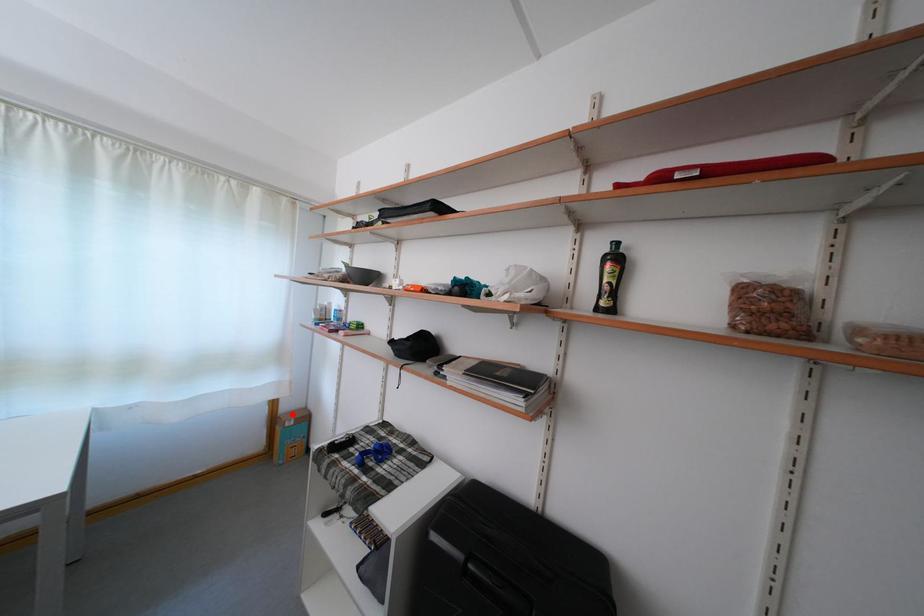
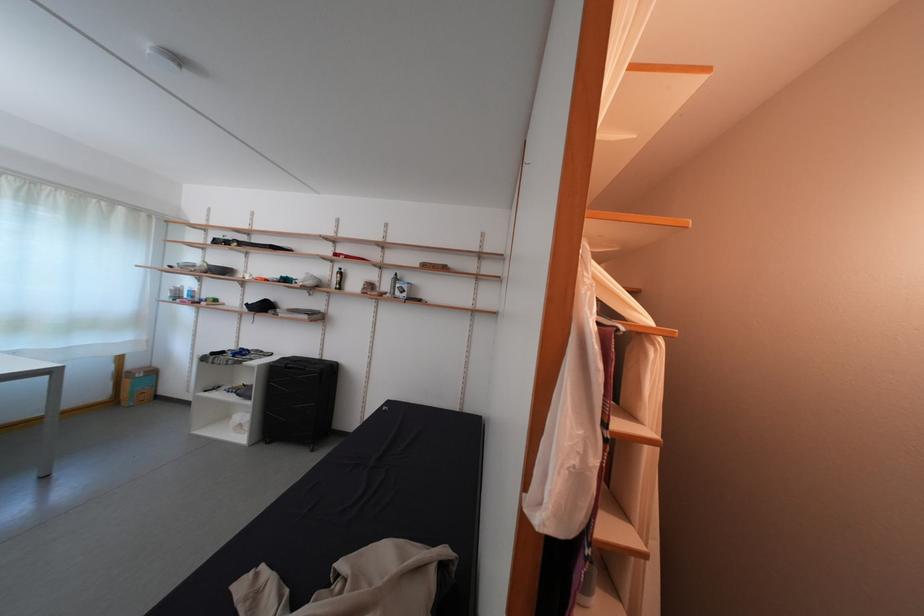
Locate, in the second image, the point that corresponds to the highlighted location in the first image.

(140, 371)